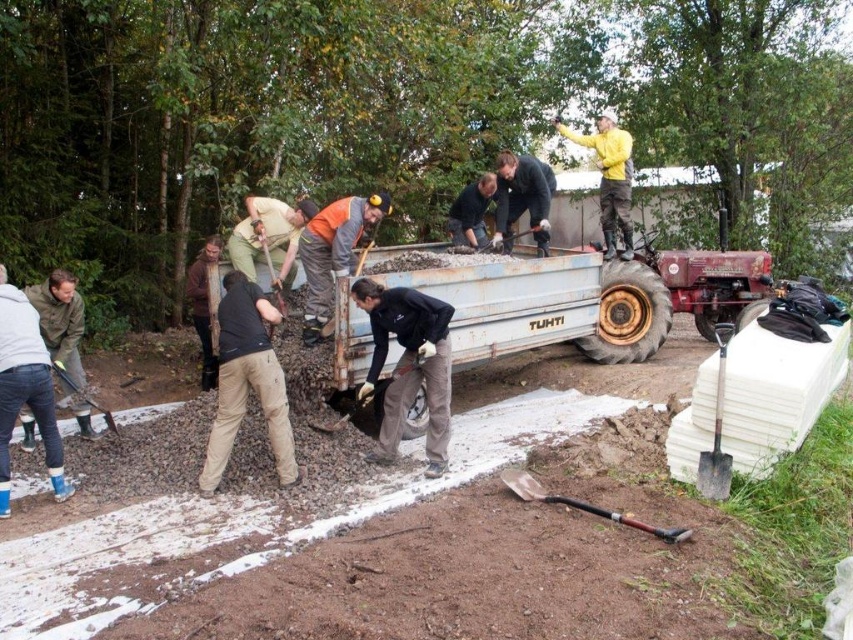
Between metallic silver shovel at lower right and black rubber shovel at lower center, which one has more height?

With more height is metallic silver shovel at lower right.

Does metallic silver shovel at lower right appear over black rubber shovel at lower center?

Incorrect, metallic silver shovel at lower right is not positioned above black rubber shovel at lower center.

Between point (717, 410) and point (422, 353), which one is positioned behind?

Point (422, 353)

You are a GUI agent. You are given a task and a screenshot of the screen. Output one action in this format:
    pyautogui.click(x=<x>, y=<y>)
    Task: Click on the metallic silver shovel at lower right
    The height and width of the screenshot is (640, 853).
    Given the screenshot: What is the action you would take?
    pyautogui.click(x=717, y=433)

Which is above, metallic silver shovel at lower left or brushed metal shovel at lower center?

Positioned higher is brushed metal shovel at lower center.

Where is `metallic silver shovel at lower left`? The height and width of the screenshot is (640, 853). metallic silver shovel at lower left is located at coordinates [84, 396].

Between point (88, 400) and point (277, 292), which one is positioned behind?

Positioned behind is point (277, 292).

You are a GUI agent. You are given a task and a screenshot of the screen. Output one action in this format:
    pyautogui.click(x=<x>, y=<y>)
    Task: Click on the metallic silver shovel at lower left
    
    Given the screenshot: What is the action you would take?
    pyautogui.click(x=84, y=396)

Describe the element at coordinates (347, 412) in the screenshot. I see `black rubber shovel at lower center` at that location.

This screenshot has height=640, width=853. I want to click on black rubber shovel at lower center, so click(347, 412).